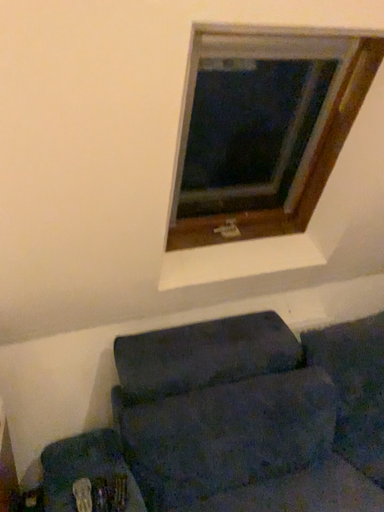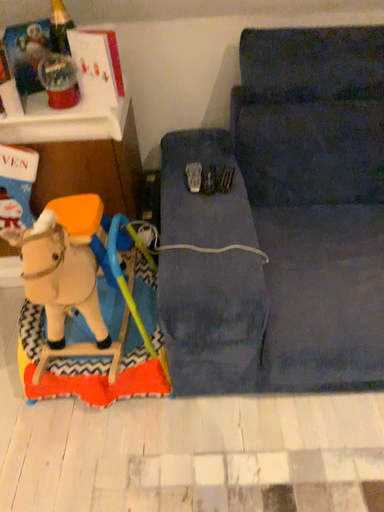
Question: Which way did the camera rotate in the video?

Choices:
 (A) rotated downward
 (B) rotated upward

Answer: (A)